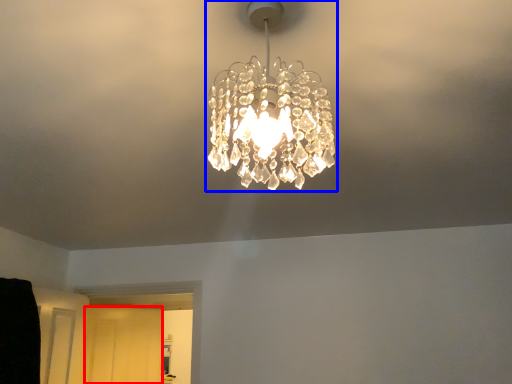
Question: Which object appears farthest to the camera in this image, glass door (highlighted by a red box) or lamp (highlighted by a blue box)?

Choices:
 (A) glass door
 (B) lamp

Answer: (A)